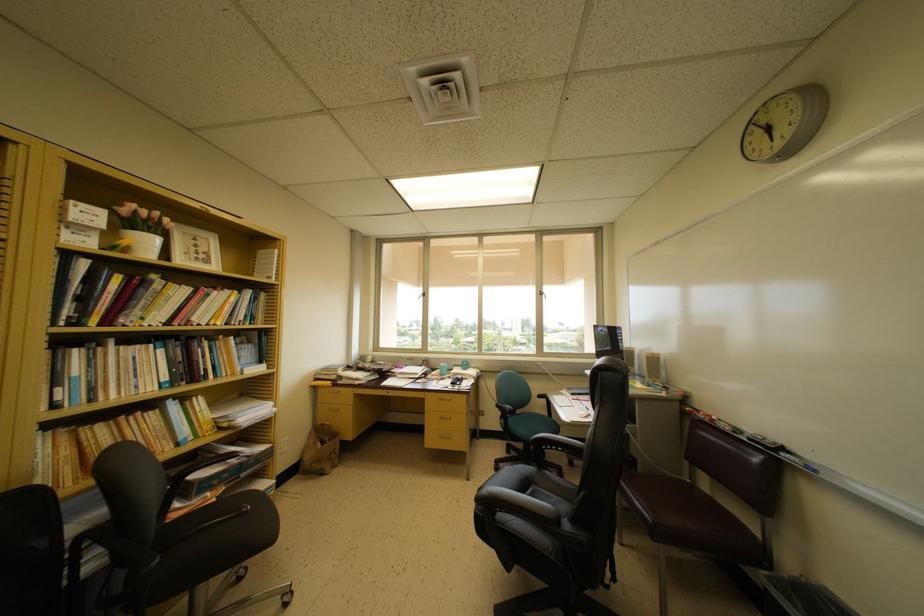
The width and height of the screenshot is (924, 616). Describe the element at coordinates (530, 496) in the screenshot. I see `a black chair sitting surface` at that location.